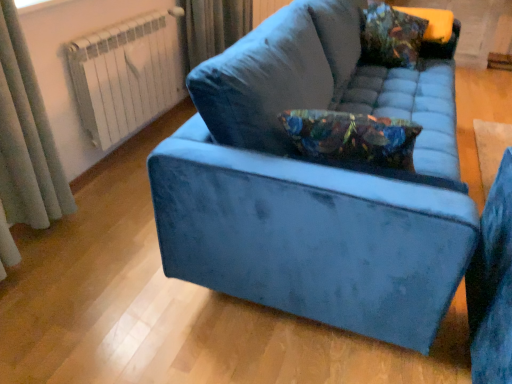
This screenshot has width=512, height=384. Identify the location of free space on the front side of gray fabric curtain at left. (44, 258).